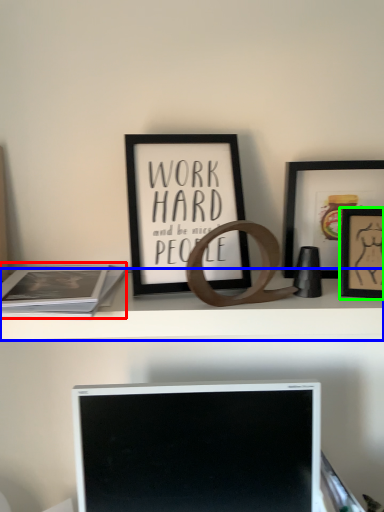
Question: Which is farther away from paperback book (highlighted by a red box)? shelf (highlighted by a blue box) or picture frame (highlighted by a green box)?

Choices:
 (A) shelf
 (B) picture frame

Answer: (B)